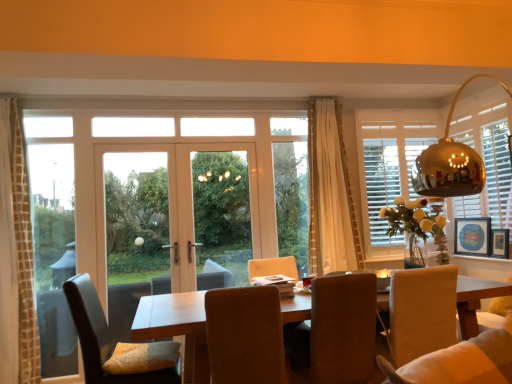
Where is `free space above white wood screen door at center (from a real-world perspective)`? This screenshot has height=384, width=512. free space above white wood screen door at center (from a real-world perspective) is located at coordinates point(217,136).